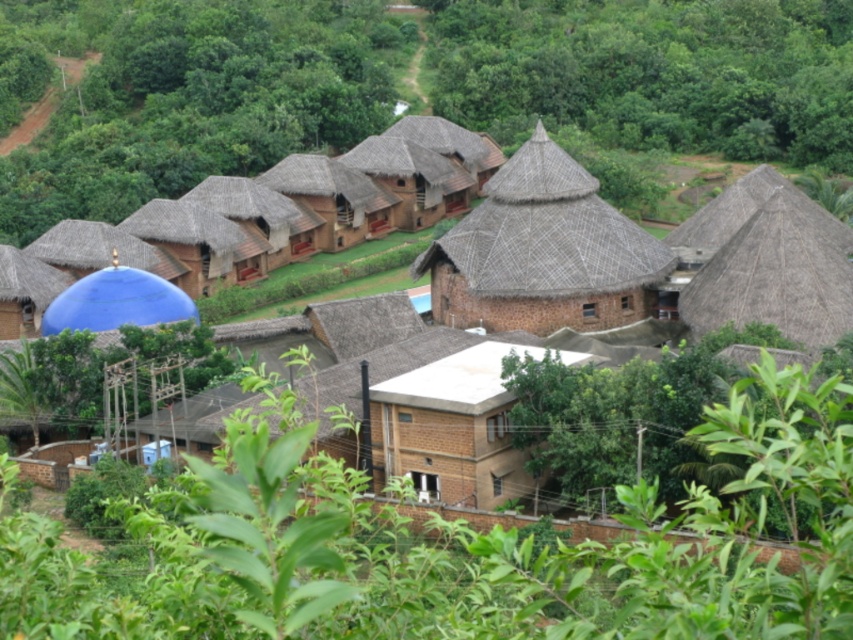
Question: Is brown thatch hut at center bigger than thatched brown hut at upper right?

Choices:
 (A) yes
 (B) no

Answer: (B)

Question: Is green leafy vegetation at center in front of thatched brown hut at upper right?

Choices:
 (A) no
 (B) yes

Answer: (B)

Question: Which of the following is the closest to the observer?

Choices:
 (A) (669, 289)
 (B) (795, 228)

Answer: (B)

Question: Which object is the closest to the green leafy vegetation at center?

Choices:
 (A) brown thatch hut at center
 (B) thatched brown hut at upper right

Answer: (A)

Question: Observing the image, what is the correct spatial positioning of green leafy vegetation at center in reference to brown thatch hut at center?

Choices:
 (A) right
 (B) left

Answer: (B)

Question: Considering the real-world distances, which object is farthest from the brown thatch hut at center?

Choices:
 (A) brown thatched-roof houses at center
 (B) thatched brown hut at upper right

Answer: (B)